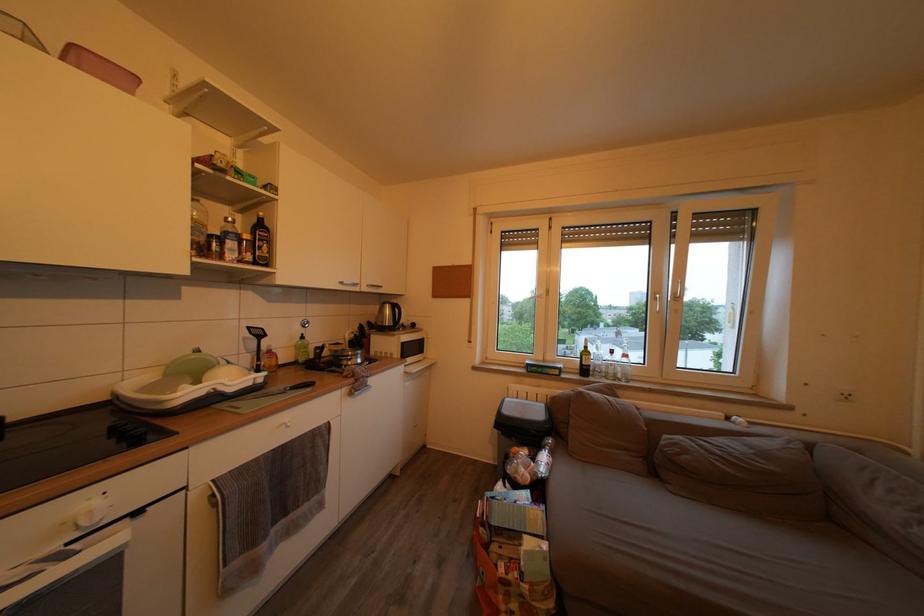
Find where to lift the clear oil bottle. Please return your answer as a coordinate pair (x, y).

(198, 228)